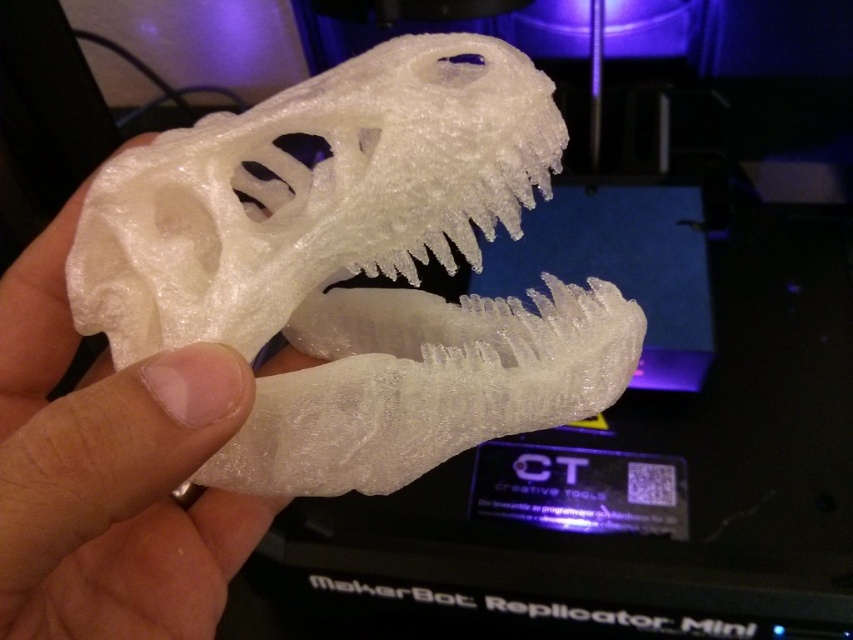
Is white matte plastic dinosaur skull at center wider than white matte plastic hand at center?

Correct, the width of white matte plastic dinosaur skull at center exceeds that of white matte plastic hand at center.

Which is behind, point (637, 326) or point (70, 353)?

Point (70, 353)

The width and height of the screenshot is (853, 640). In order to click on white matte plastic dinosaur skull at center in this screenshot , I will do [x=355, y=268].